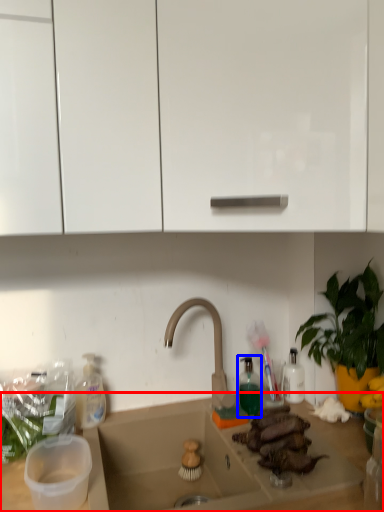
Question: Among these objects, which one is farthest to the camera, countertop (highlighted by a red box) or bottle (highlighted by a blue box)?

Choices:
 (A) countertop
 (B) bottle

Answer: (B)